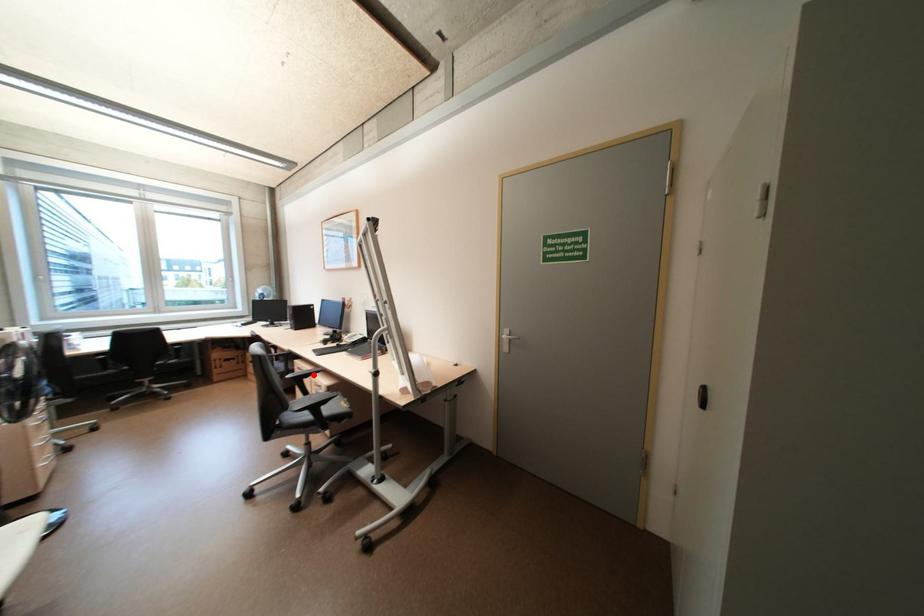
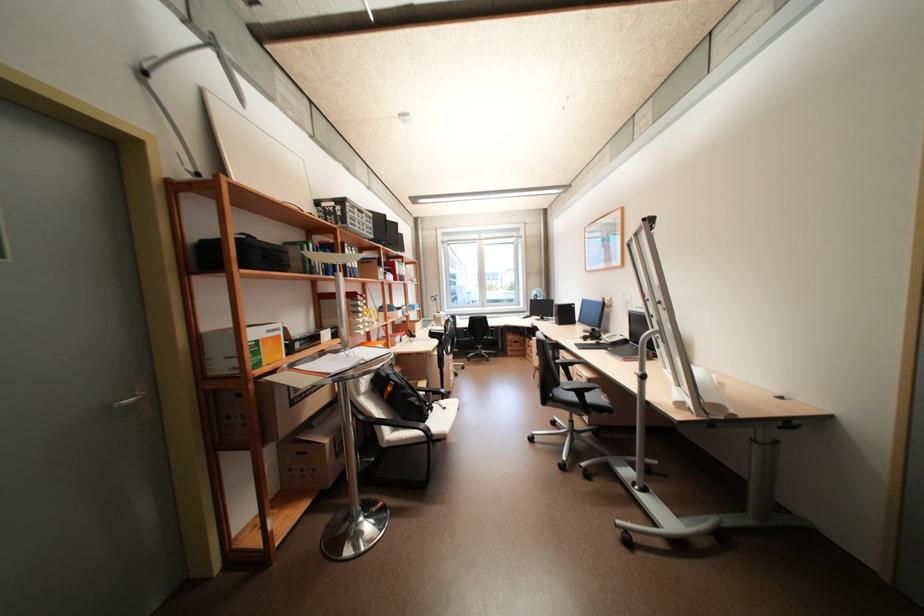
The point at the highlighted location is marked in the first image. Where is the corresponding point in the second image?

(578, 363)